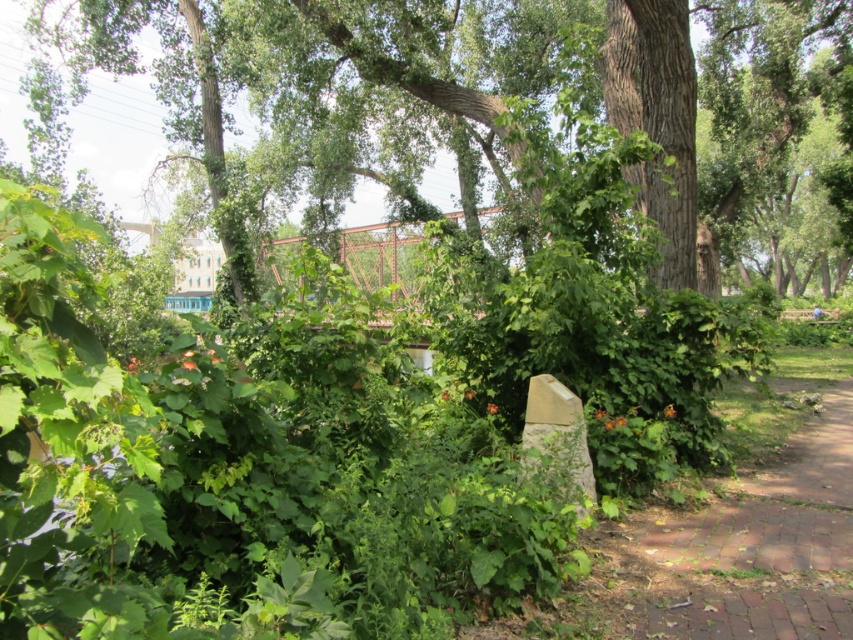
You are a hiker who wants to reach the green leafy tree at center from the brick paved path at lower right. Which direction should you move towards?

The brick paved path at lower right is positioned on the left side of the green leafy tree at center, so you should move towards the right to reach the green leafy tree at center.

You are standing at the point marked as point (751, 548) in the image. What type of surface are you currently standing on?

The point (751, 548) is on brick paved path at lower right, so you are standing on a brick paved path.

You are standing in a lush green environment with dense foliage and a red metal bridge in the midground. You see a point located at coordinates (817,630). Can you estimate how far this point is from your current position?

The point at (817,630) is 3.51 meters away from the viewer.